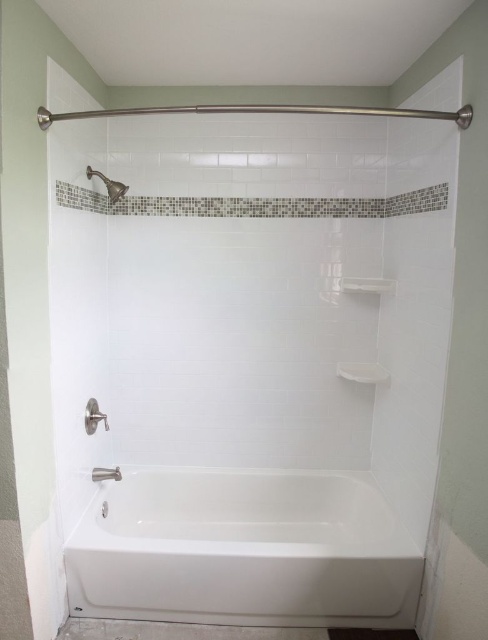
Question: Is white ceramic bathtub at lower center above brushed metal showerhead at upper left?

Choices:
 (A) no
 (B) yes

Answer: (A)

Question: Which object is positioned farthest from the brushed metal showerhead at upper left?

Choices:
 (A) white glossy shelf at upper center
 (B) white ceramic bathtub at lower center

Answer: (B)

Question: Considering the relative positions of white ceramic bathtub at lower center and brushed metal showerhead at upper left in the image provided, where is white ceramic bathtub at lower center located with respect to brushed metal showerhead at upper left?

Choices:
 (A) left
 (B) right

Answer: (B)

Question: Which point is farther to the camera?

Choices:
 (A) white ceramic bathtub at lower center
 (B) white glossy shelf at upper center
 (C) brushed metal showerhead at upper left

Answer: (B)

Question: Based on their relative distances, which object is farther from the white ceramic bathtub at lower center?

Choices:
 (A) white glossy shelf at upper center
 (B) brushed metal showerhead at upper left

Answer: (B)

Question: Can you confirm if white ceramic bathtub at lower center is positioned to the left of white glossy shelf at upper center?

Choices:
 (A) no
 (B) yes

Answer: (B)